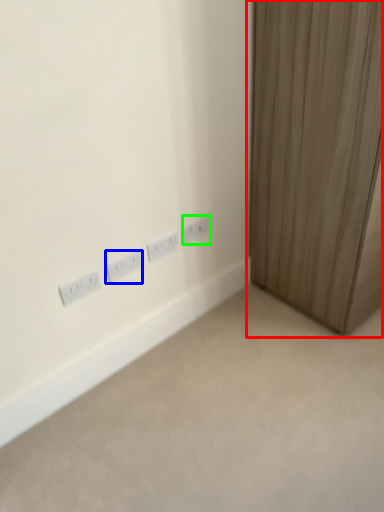
Question: Based on their relative distances, which object is farther from curtain (highlighted by a red box)? Choose from power plugs and sockets (highlighted by a blue box) and power plugs and sockets (highlighted by a green box).

Choices:
 (A) power plugs and sockets
 (B) power plugs and sockets

Answer: (A)